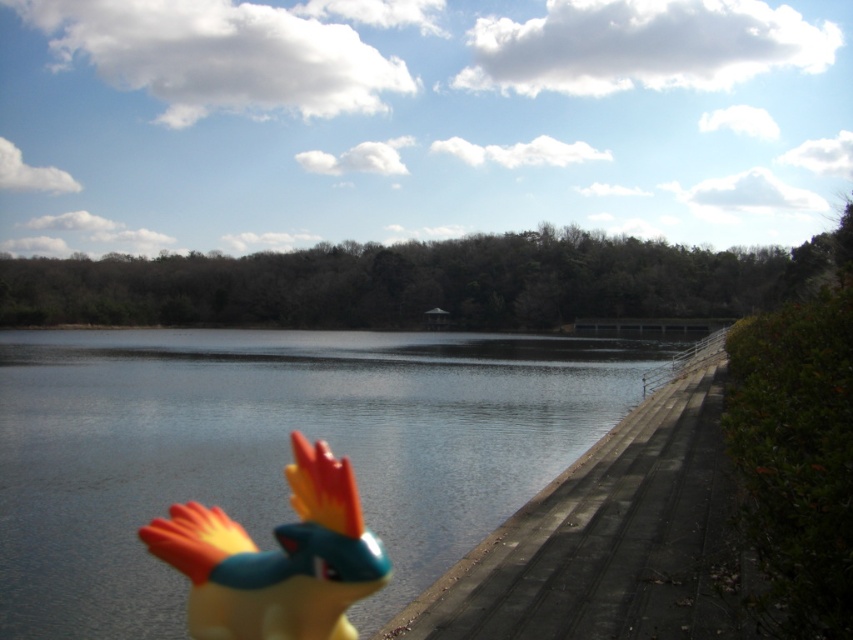
Question: Which point appears closest to the camera in this image?

Choices:
 (A) coord(717,432)
 (B) coord(412,401)

Answer: (A)

Question: Which object is positioned closest to the glossy water at lower left?

Choices:
 (A) concrete at right
 (B) shiny plastic bird at lower left

Answer: (A)

Question: Can you confirm if glossy water at lower left is positioned to the left of shiny plastic bird at lower left?

Choices:
 (A) yes
 (B) no

Answer: (A)

Question: Does glossy water at lower left appear over shiny plastic bird at lower left?

Choices:
 (A) yes
 (B) no

Answer: (B)

Question: Which point is farther to the camera?

Choices:
 (A) (700, 584)
 (B) (297, 525)
 (C) (416, 464)

Answer: (C)

Question: Does concrete at right have a lesser width compared to shiny plastic bird at lower left?

Choices:
 (A) no
 (B) yes

Answer: (A)